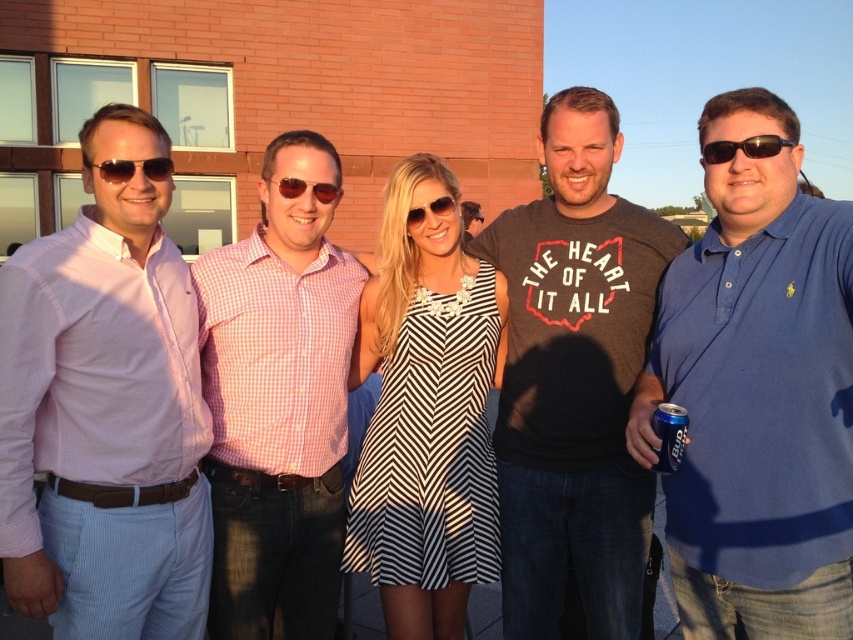
You are a photographer trying to capture a closeup of the pink checkered shirt at center and the matte black sunglasses at left. Since you can only focus on one object at a time, which one should you focus on first if you want to ensure the closest object is in focus?

The matte black sunglasses at left should be focused on first because they are closer to the photographer than the pink checkered shirt at center, so focusing on them ensures the closest object is sharp.

You are standing in front of the brick building and want to take a photo of the group. If you focus on point 1 at point [584,371] and point 2 at point [670,472], which point is closer to the camera?

Point [584,371] is closer to the camera than point [670,472].